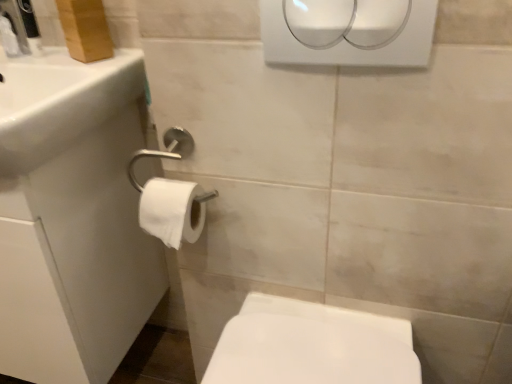
Question: Is white matte toilet paper at lower left positioned in front of white plastic hand dryer at upper center?

Choices:
 (A) yes
 (B) no

Answer: (B)

Question: Is white matte toilet paper at lower left aimed at white plastic hand dryer at upper center?

Choices:
 (A) no
 (B) yes

Answer: (A)

Question: From the image's perspective, is white matte toilet paper at lower left located beneath white plastic hand dryer at upper center?

Choices:
 (A) no
 (B) yes

Answer: (B)

Question: Is white matte toilet paper at lower left shorter than white plastic hand dryer at upper center?

Choices:
 (A) yes
 (B) no

Answer: (A)

Question: Is white matte toilet paper at lower left further to the viewer compared to white plastic hand dryer at upper center?

Choices:
 (A) no
 (B) yes

Answer: (B)

Question: Would you say white glossy sink at upper left is inside or outside white glossy bidet at lower right?

Choices:
 (A) inside
 (B) outside

Answer: (B)

Question: Considering the positions of white glossy sink at upper left and white glossy bidet at lower right in the image, is white glossy sink at upper left taller or shorter than white glossy bidet at lower right?

Choices:
 (A) short
 (B) tall

Answer: (A)

Question: Based on their sizes in the image, would you say white glossy sink at upper left is bigger or smaller than white glossy bidet at lower right?

Choices:
 (A) small
 (B) big

Answer: (B)

Question: Considering the positions of point (53, 119) and point (224, 327), is point (53, 119) closer or farther from the camera than point (224, 327)?

Choices:
 (A) farther
 (B) closer

Answer: (B)

Question: Looking at the image, does white plastic hand dryer at upper center seem bigger or smaller compared to white matte toilet paper at lower left?

Choices:
 (A) big
 (B) small

Answer: (B)

Question: Would you say white plastic hand dryer at upper center is to the left or to the right of white matte toilet paper at lower left in the picture?

Choices:
 (A) left
 (B) right

Answer: (B)

Question: From a real-world perspective, is white plastic hand dryer at upper center positioned above or below white matte toilet paper at lower left?

Choices:
 (A) above
 (B) below

Answer: (A)

Question: From the image's perspective, relative to white matte toilet paper at lower left, is white plastic hand dryer at upper center above or below?

Choices:
 (A) above
 (B) below

Answer: (A)

Question: Is white glossy sink at upper left in front of or behind white matte toilet paper at lower left in the image?

Choices:
 (A) front
 (B) behind

Answer: (A)

Question: Do you think white glossy sink at upper left is within white matte toilet paper at lower left, or outside of it?

Choices:
 (A) outside
 (B) inside

Answer: (A)